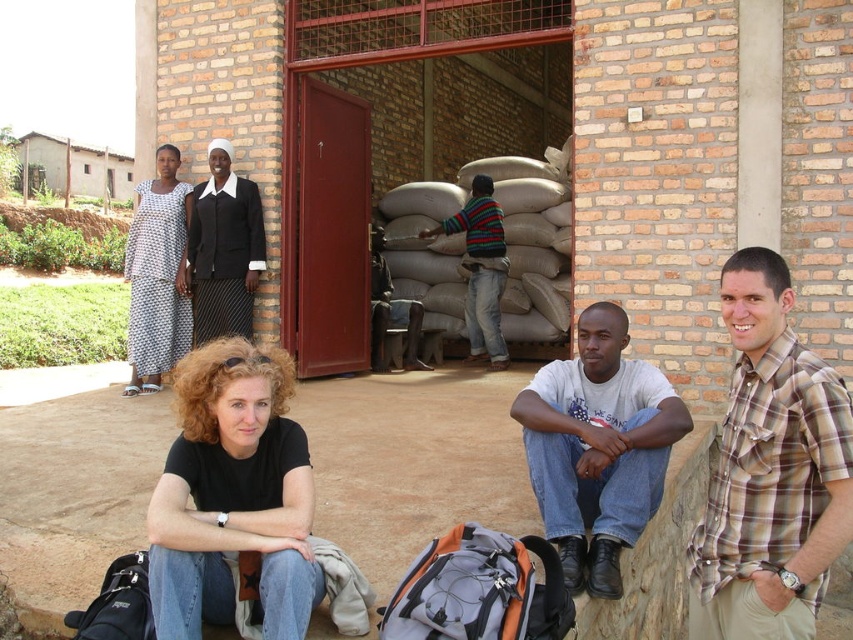
You are a photographer trying to capture the black cotton shirt at lower left in the image. Based on its coordinates, where should you focus your camera?

The black cotton shirt at lower left is located at coordinates point (231, 496), so you should focus your camera there.